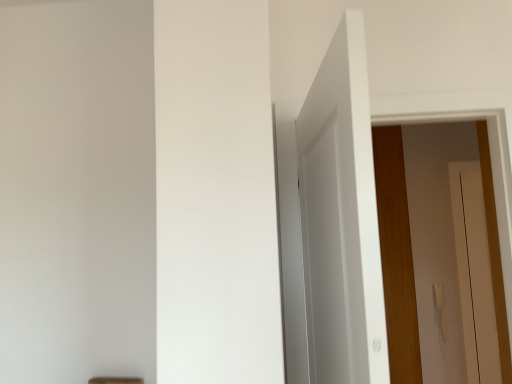
Question: Is white matte door at upper center, acting as the first door starting from the front, inside or outside of wooden door at right, positioned as the 1th door in back-to-front order?

Choices:
 (A) inside
 (B) outside

Answer: (B)

Question: From the image's perspective, is white matte door at upper center, placed as the second door when sorted from back to front, positioned above or below wooden door at right, the 2th door viewed from the left?

Choices:
 (A) above
 (B) below

Answer: (A)

Question: Would you say white matte door at upper center, placed as the second door when sorted from back to front, is to the left or to the right of wooden door at right, positioned as the 1th door in back-to-front order, in the picture?

Choices:
 (A) left
 (B) right

Answer: (A)

Question: In terms of height, does wooden door at right, the 1th door viewed from the right, look taller or shorter compared to white matte door at upper center, acting as the first door starting from the front?

Choices:
 (A) tall
 (B) short

Answer: (A)

Question: From a real-world perspective, relative to white matte door at upper center, placed as the second door when sorted from back to front, is wooden door at right, positioned as the 1th door in back-to-front order, vertically above or below?

Choices:
 (A) below
 (B) above

Answer: (A)

Question: Is wooden door at right, which appears as the second door when viewed from the front, inside the boundaries of white matte door at upper center, placed as the second door when sorted from back to front, or outside?

Choices:
 (A) inside
 (B) outside

Answer: (B)

Question: Considering the positions of wooden door at right, positioned as the 1th door in back-to-front order, and white matte door at upper center, acting as the second door starting from the right, in the image, is wooden door at right, positioned as the 1th door in back-to-front order, bigger or smaller than white matte door at upper center, acting as the second door starting from the right,?

Choices:
 (A) small
 (B) big

Answer: (B)